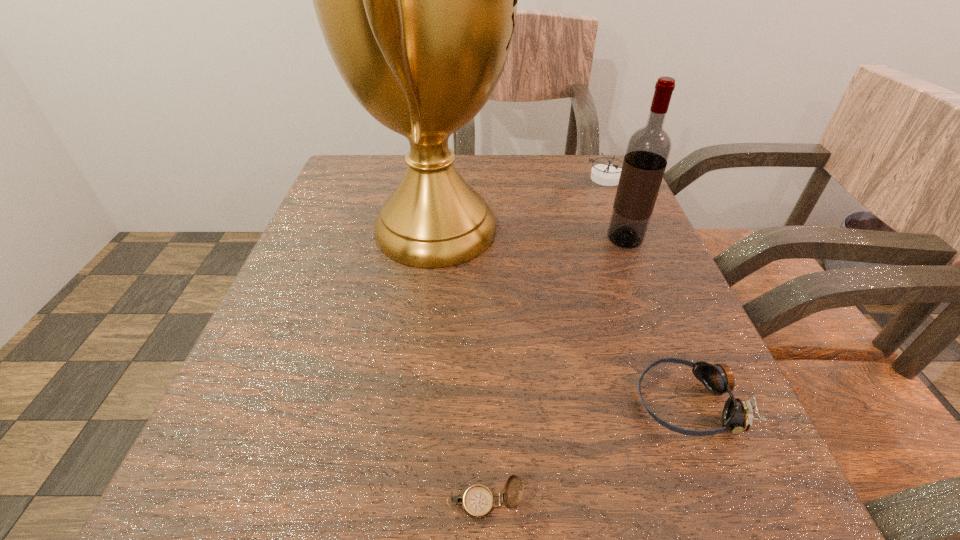
This screenshot has width=960, height=540. What are the coordinates of `blank area at the far right corner` in the screenshot? It's located at (568, 167).

I want to click on vacant space at the near right corner of the desktop, so [700, 505].

Find the location of a particular element. free spot between the left compass and the trophy cup is located at coordinates (460, 366).

Find the location of a particular element. Image resolution: width=960 pixels, height=540 pixels. unoccupied area between the right compass and the tallest object is located at coordinates (520, 204).

Where is `free space between the tallest object and the right compass`? Image resolution: width=960 pixels, height=540 pixels. free space between the tallest object and the right compass is located at coordinates (520, 204).

The width and height of the screenshot is (960, 540). What are the coordinates of `vacant area that lies between the nearest object and the right compass` in the screenshot? It's located at (545, 340).

Where is `free spot between the trophy cup and the second tallest object`? The width and height of the screenshot is (960, 540). free spot between the trophy cup and the second tallest object is located at coordinates (530, 234).

You are a GUI agent. You are given a task and a screenshot of the screen. Output one action in this format:
    pyautogui.click(x=<x>, y=<y>)
    Task: Click on the free area in between the goggles and the right compass
    This screenshot has width=960, height=540.
    Given the screenshot: What is the action you would take?
    pyautogui.click(x=646, y=290)

Where is `unoccupied area between the tallest object and the nearest object`? unoccupied area between the tallest object and the nearest object is located at coordinates (460, 366).

You are a GUI agent. You are given a task and a screenshot of the screen. Output one action in this format:
    pyautogui.click(x=<x>, y=<y>)
    Task: Click on the vacant area that lies between the farther compass and the nearer compass
    The image size is (960, 540).
    Given the screenshot: What is the action you would take?
    pyautogui.click(x=545, y=340)